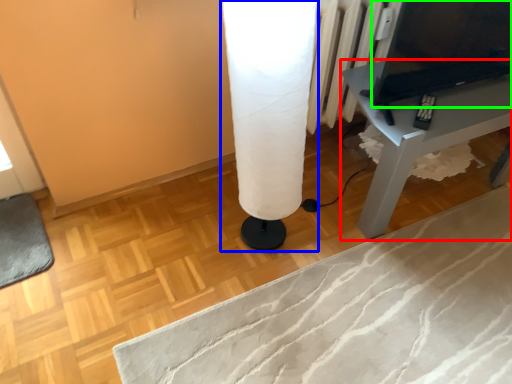
Question: Which is farther away from table (highlighted by a red box)? table lamp (highlighted by a blue box) or computer (highlighted by a green box)?

Choices:
 (A) table lamp
 (B) computer

Answer: (A)